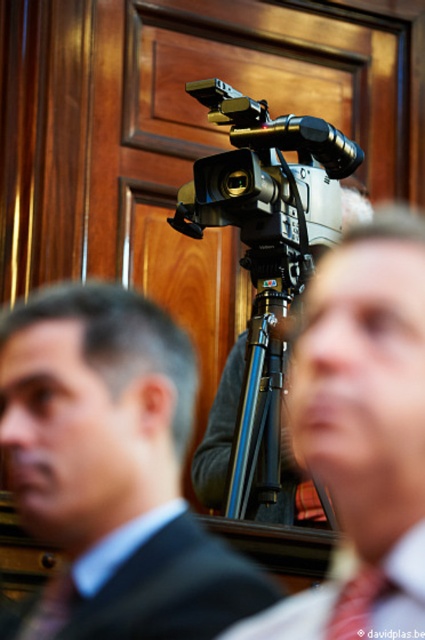
Can you confirm if matte black suit at center is taller than matte black camera at center?

In fact, matte black suit at center may be shorter than matte black camera at center.

The width and height of the screenshot is (425, 640). What do you see at coordinates (112, 468) in the screenshot?
I see `matte black suit at center` at bounding box center [112, 468].

Is point (113, 600) positioned after point (297, 595)?

No, it is in front of (297, 595).

Find the location of `matte black suit at center`. matte black suit at center is located at coordinates (112, 468).

Can you confirm if matte black suit at center is positioned above red silk tie at center?

Yes, matte black suit at center is above red silk tie at center.

Is point (99, 627) more distant than point (373, 588)?

Yes, it is.

At what (x,y) coordinates should I click in order to perform the action: click on matte black suit at center. Please return your answer as a coordinate pair (x, y). The image size is (425, 640). Looking at the image, I should click on (112, 468).

From the picture: Which of these two, silver metallic camera at center or red silk tie at center, stands shorter?

Standing shorter between the two is silver metallic camera at center.

Locate an element on the screen. silver metallic camera at center is located at coordinates (268, 182).